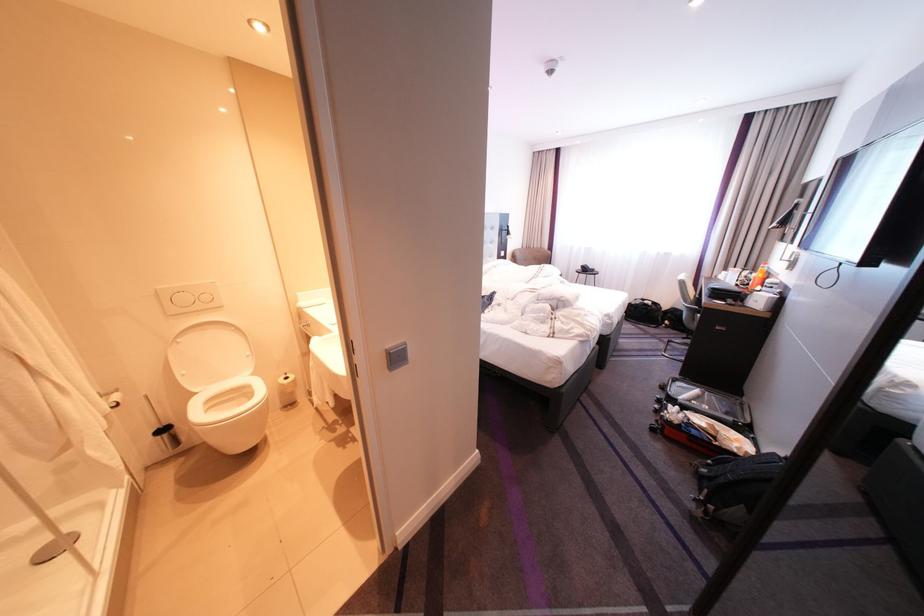
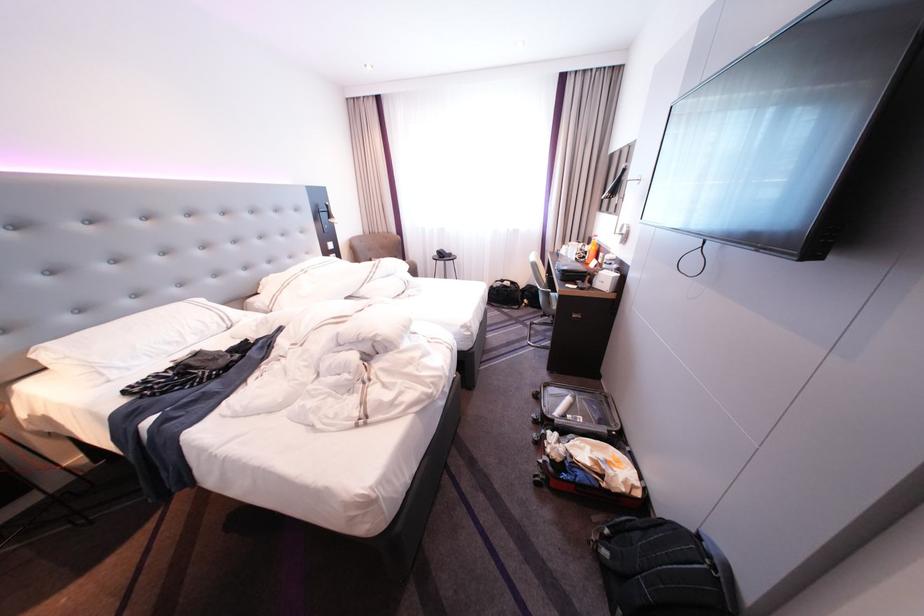
The images are taken continuously from a first-person perspective. In which direction are you moving?

The movement direction of the cameraman is right, forward.